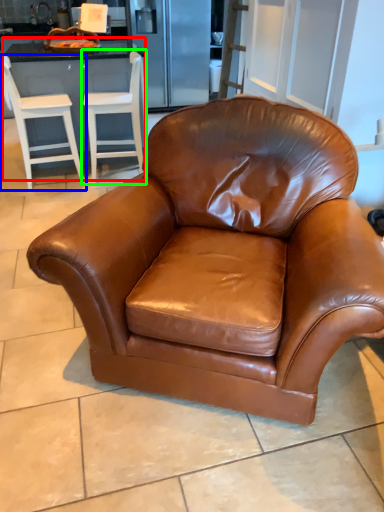
Question: Which object is the farthest from dresser (highlighted by a red box)? Choose among these: chair (highlighted by a blue box) or chair (highlighted by a green box).

Choices:
 (A) chair
 (B) chair

Answer: (A)